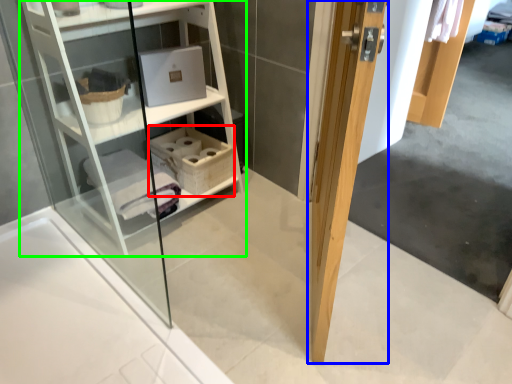
Question: Considering the real-world distances, which object is farthest from basket (highlighted by a red box)? door (highlighted by a blue box) or shelf (highlighted by a green box)?

Choices:
 (A) door
 (B) shelf

Answer: (A)